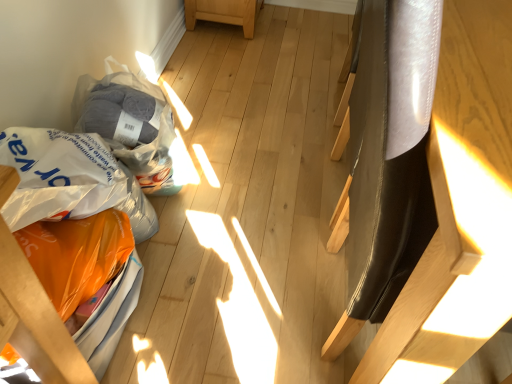
Question: Does orange plastic grocery bag at lower left, the second grocery bag when ordered from top to bottom, appear on the right side of shiny black chair at right, which appears as the first furniture when viewed from the right?

Choices:
 (A) no
 (B) yes

Answer: (A)

Question: From a real-world perspective, is orange plastic grocery bag at lower left, which ranks as the 1th grocery bag in bottom-to-top order, beneath shiny black chair at right, the second furniture positioned from the left?

Choices:
 (A) no
 (B) yes

Answer: (B)

Question: Is orange plastic grocery bag at lower left, the second grocery bag when ordered from top to bottom, shorter than shiny black chair at right, which appears as the first furniture when viewed from the right?

Choices:
 (A) yes
 (B) no

Answer: (A)

Question: Does orange plastic grocery bag at lower left, the second grocery bag when ordered from top to bottom, contain shiny black chair at right, the second furniture positioned from the left?

Choices:
 (A) yes
 (B) no

Answer: (B)

Question: Is orange plastic grocery bag at lower left, the second grocery bag when ordered from top to bottom, facing away from shiny black chair at right, which appears as the first furniture when viewed from the right?

Choices:
 (A) no
 (B) yes

Answer: (A)

Question: In terms of width, does translucent plastic grocery bag at lower left, the first grocery bag viewed from the top, look wider or thinner when compared to orange plastic bag at lower left, which ranks as the second furniture in right-to-left order?

Choices:
 (A) wide
 (B) thin

Answer: (B)

Question: Is translucent plastic grocery bag at lower left, which ranks as the 2th grocery bag in bottom-to-top order, situated inside orange plastic bag at lower left, marked as the 1th furniture in a left-to-right arrangement, or outside?

Choices:
 (A) outside
 (B) inside

Answer: (A)

Question: Visually, is translucent plastic grocery bag at lower left, the first grocery bag viewed from the top, positioned to the left or to the right of orange plastic bag at lower left, marked as the 1th furniture in a left-to-right arrangement?

Choices:
 (A) right
 (B) left

Answer: (A)

Question: Considering their positions, is translucent plastic grocery bag at lower left, which ranks as the 2th grocery bag in bottom-to-top order, located in front of or behind orange plastic bag at lower left, marked as the 1th furniture in a left-to-right arrangement?

Choices:
 (A) behind
 (B) front

Answer: (A)

Question: From the image's perspective, is orange plastic grocery bag at lower left, the second grocery bag when ordered from top to bottom, above or below translucent plastic grocery bag at lower left, the first grocery bag viewed from the top?

Choices:
 (A) below
 (B) above

Answer: (A)

Question: Considering the positions of orange plastic grocery bag at lower left, the second grocery bag when ordered from top to bottom, and translucent plastic grocery bag at lower left, which ranks as the 2th grocery bag in bottom-to-top order, in the image, is orange plastic grocery bag at lower left, the second grocery bag when ordered from top to bottom, wider or thinner than translucent plastic grocery bag at lower left, which ranks as the 2th grocery bag in bottom-to-top order,?

Choices:
 (A) thin
 (B) wide

Answer: (B)

Question: In the image, is orange plastic grocery bag at lower left, which ranks as the 1th grocery bag in bottom-to-top order, on the left side or the right side of translucent plastic grocery bag at lower left, which ranks as the 2th grocery bag in bottom-to-top order?

Choices:
 (A) right
 (B) left

Answer: (B)

Question: Based on their sizes in the image, would you say orange plastic grocery bag at lower left, the second grocery bag when ordered from top to bottom, is bigger or smaller than translucent plastic grocery bag at lower left, the first grocery bag viewed from the top?

Choices:
 (A) small
 (B) big

Answer: (A)

Question: Considering the positions of translucent plastic grocery bag at lower left, which ranks as the 2th grocery bag in bottom-to-top order, and orange plastic grocery bag at lower left, the second grocery bag when ordered from top to bottom, in the image, is translucent plastic grocery bag at lower left, which ranks as the 2th grocery bag in bottom-to-top order, bigger or smaller than orange plastic grocery bag at lower left, the second grocery bag when ordered from top to bottom,?

Choices:
 (A) big
 (B) small

Answer: (A)

Question: From a real-world perspective, relative to orange plastic grocery bag at lower left, which ranks as the 1th grocery bag in bottom-to-top order, is translucent plastic grocery bag at lower left, the first grocery bag viewed from the top, vertically above or below?

Choices:
 (A) below
 (B) above

Answer: (B)